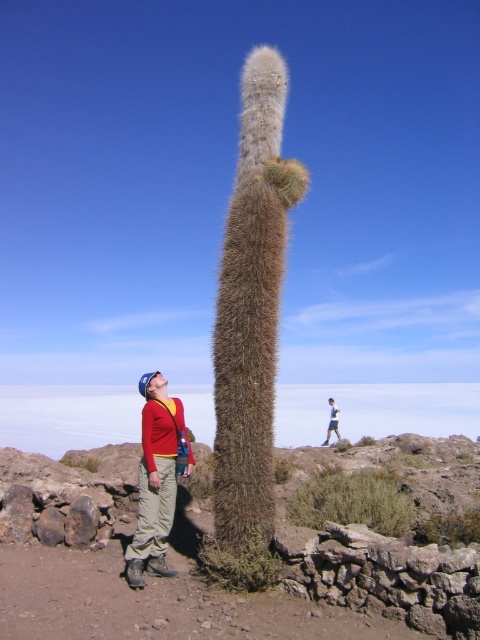
You are a photographer trying to capture the green spiky cactus at center and the light blue denim jacket at lower center in the same frame. Based on their positions, which object will appear closer to the camera in the photo?

The green spiky cactus at center appears closer to the camera because it is in front of the light blue denim jacket at lower center.

You are a photographer trying to capture both the green spiky cactus at center and the fuzzy brown cactus at center in a single frame. Your camera has a maximum focus range of 3 meters. Can you achieve this without moving your position?

The green spiky cactus at center is 3.54 meters away from the fuzzy brown cactus at center. Since the distance between them exceeds the camera maximum focus range of 3 meters, you cannot capture both in a single frame without moving your position.

You are a photographer trying to capture both the green spiky cactus at center and the fuzzy brown cactus at center in a single frame. Based on their heights, which cactus should you focus on to ensure both are fully visible in your shot?

The green spiky cactus at center has a lesser height compared to the fuzzy brown cactus at center. To ensure both are fully visible, focus on the fuzzy brown cactus at center as it is taller, allowing the shorter green spiky cactus at center to fit within the frame.